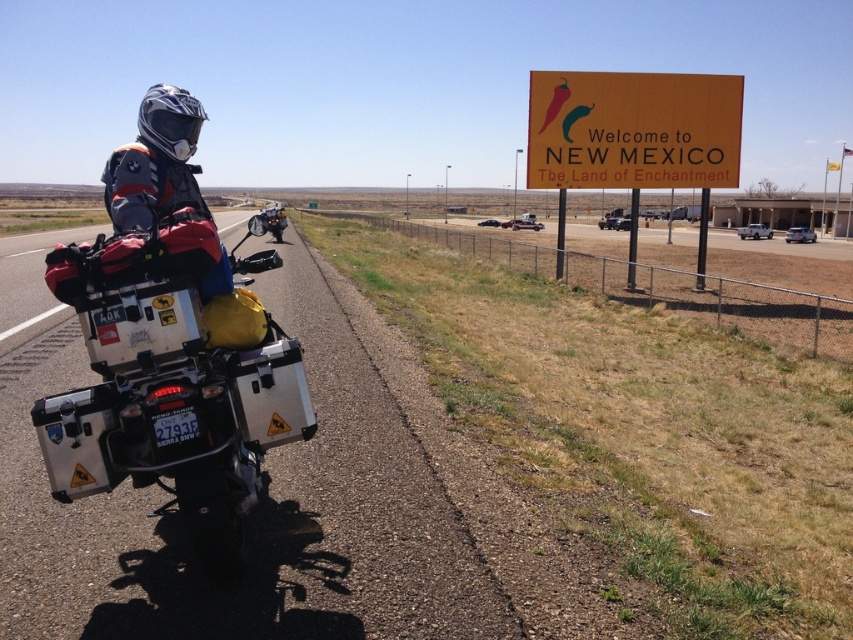
Can you confirm if yellow matte sign at upper right is wider than matte black motorcycle at center?

In fact, yellow matte sign at upper right might be narrower than matte black motorcycle at center.

Does yellow matte sign at upper right appear over matte black motorcycle at center?

Incorrect, yellow matte sign at upper right is not positioned above matte black motorcycle at center.

The width and height of the screenshot is (853, 640). I want to click on yellow matte sign at upper right, so click(x=633, y=129).

Who is positioned more to the right, metallic silver motorcycle at left or silver metallic motorcycle at left?

silver metallic motorcycle at left is more to the right.

Does point (236, 220) come closer to viewer compared to point (291, 387)?

No, it is behind (291, 387).

In order to click on metallic silver motorcycle at left in this screenshot , I will do `click(248, 516)`.

How much distance is there between metallic silver motorcycle at left and yellow matte sign at upper right?

metallic silver motorcycle at left is 37.92 feet from yellow matte sign at upper right.

Where is `metallic silver motorcycle at left`? The width and height of the screenshot is (853, 640). metallic silver motorcycle at left is located at coordinates (248, 516).

Between point (149, 556) and point (659, 97), which one is positioned in front?

Point (149, 556) is in front.

Locate an element on the screen. metallic silver motorcycle at left is located at coordinates (248, 516).